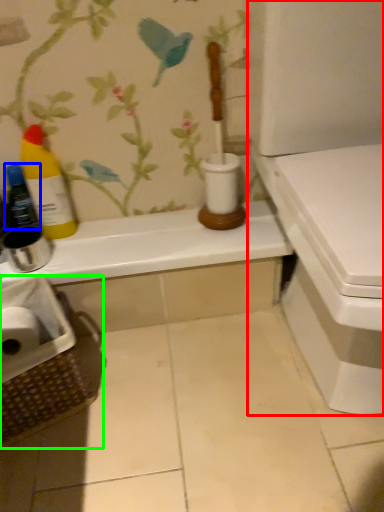
Question: Which is nearer to the toilet (highlighted by a red box)? bottle (highlighted by a blue box) or laundry basket (highlighted by a green box).

Choices:
 (A) bottle
 (B) laundry basket

Answer: (B)